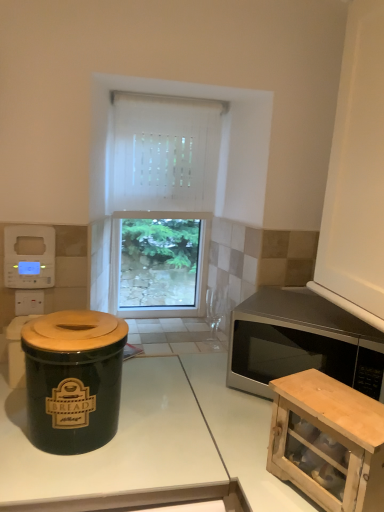
At what (x,y) coordinates should I click in order to perform the action: click on vacant space to the left of satin silver microwave at right. Please return your answer as a coordinate pair (x, y). Looking at the image, I should click on (216, 390).